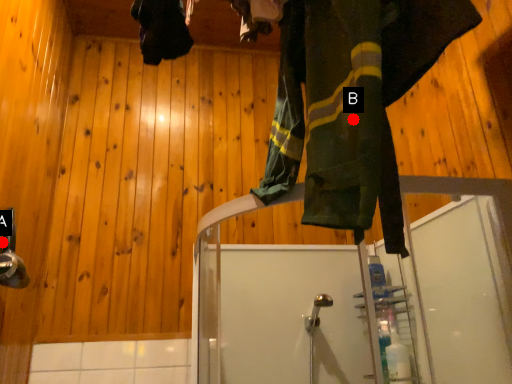
Question: Two points are circled on the image, labeled by A and B beside each circle. Which point is closer to the camera?

Choices:
 (A) A is closer
 (B) B is closer

Answer: (B)